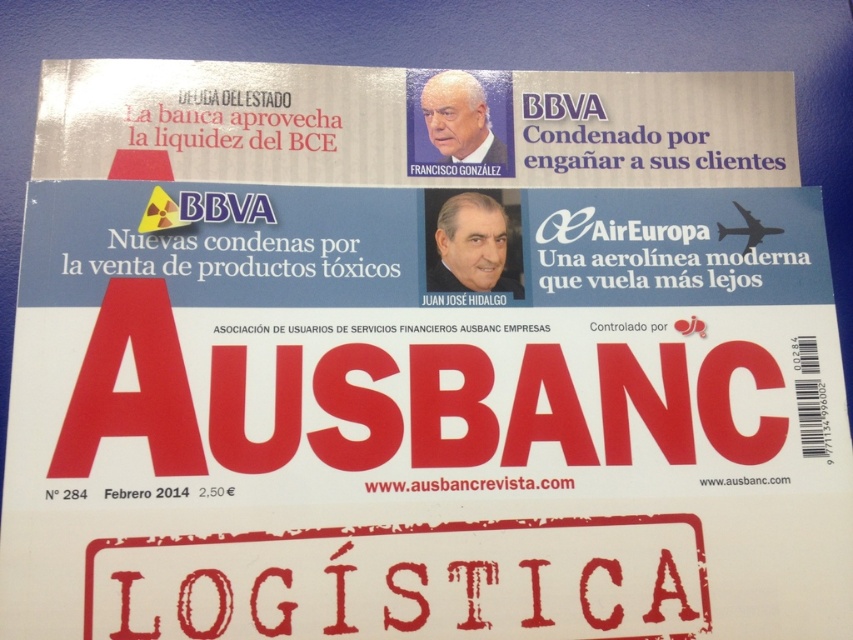
Looking at this image, looking at the magazine cover described, where is the smooth skin portrait at center in relation to the white matte portrait at upper center?

The smooth skin portrait at center is located to the right of the white matte portrait at upper center.

What is the spatial relationship between the smooth skin portrait at center and the white matte portrait at upper center on the magazine cover?

The smooth skin portrait at center is positioned in front of the white matte portrait at upper center.